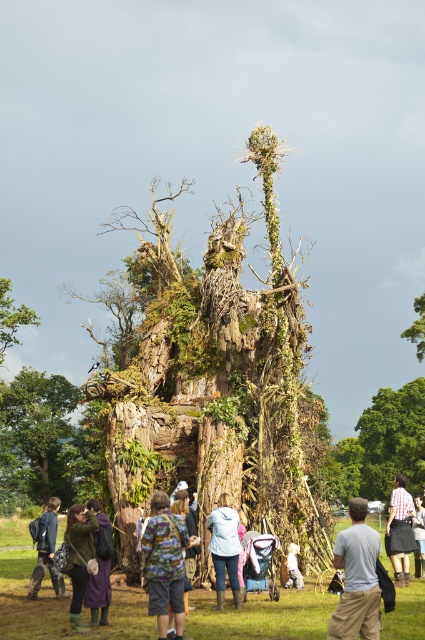
Question: Which point is closer to the camera?

Choices:
 (A) (218, 602)
 (B) (147, 524)
 (C) (74, 577)

Answer: (C)

Question: Considering the real-world distances, which object is farthest from the green mossy tree at lower left?

Choices:
 (A) denim jacket at lower left
 (B) green leafy tree at center

Answer: (A)

Question: Is green fabric jacket at lower left bigger than light brown leather jacket at center?

Choices:
 (A) yes
 (B) no

Answer: (B)

Question: Can you confirm if denim jacket at lower left is smaller than green leafy tree at upper right?

Choices:
 (A) yes
 (B) no

Answer: (A)

Question: Which is farther from the camouflage shirt at center?

Choices:
 (A) green fabric jacket at lower left
 (B) plaid shirt at center
 (C) green mossy tree at lower left
 (D) rusty wood sculpture at center

Answer: (C)

Question: Is green mossy tree at lower left positioned behind camouflage shirt at center?

Choices:
 (A) yes
 (B) no

Answer: (A)